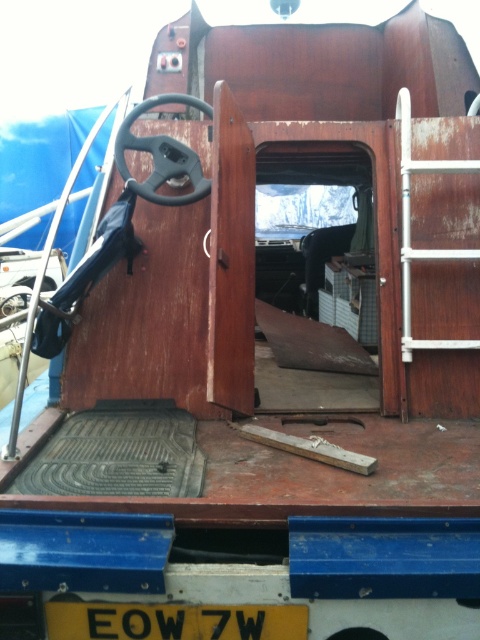
You are a delivery driver who needs to check the license plate number to confirm your vehicle. While sitting in the driver seat, which object is closer to your eyes between the yellow matte license plate at bottom and the matte black steering wheel at center?

The matte black steering wheel at center is closer to your eyes because it is positioned at the center, whereas the yellow matte license plate at bottom is located lower and further away.

Based on the photo, you are standing outside the vehicle and looking into the cabin area. Where is the yellow matte license plate at bottom located in relation to the steering wheel?

The yellow matte license plate at bottom is located at the bottom of the image, near the lower edge, positioned below the steering wheel.

You are standing outside a wooden cabin of a truck or van and want to locate the yellow matte license plate at bottom. According to the coordinates provided, where exactly would you find it?

The yellow matte license plate at bottom is located at the coordinates point (173, 621).